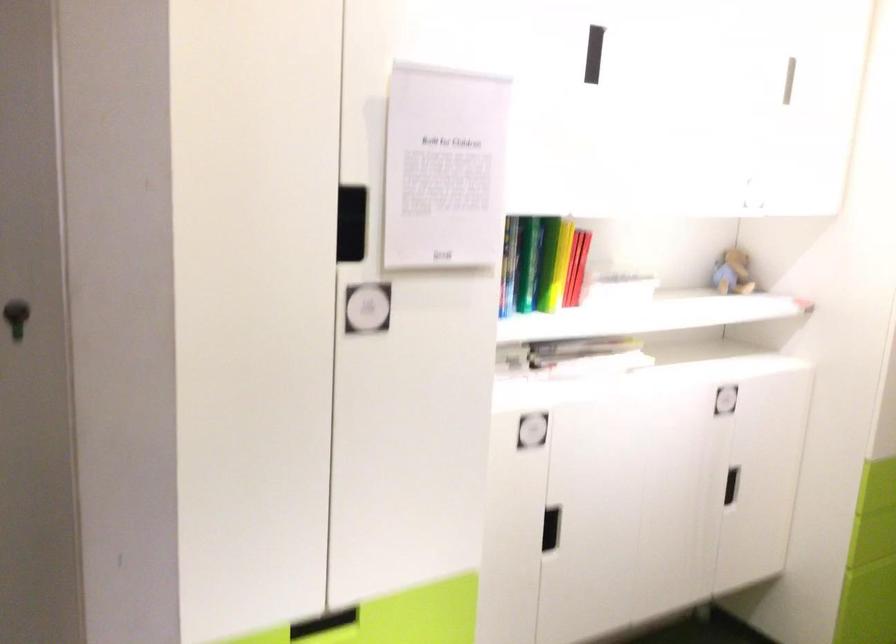
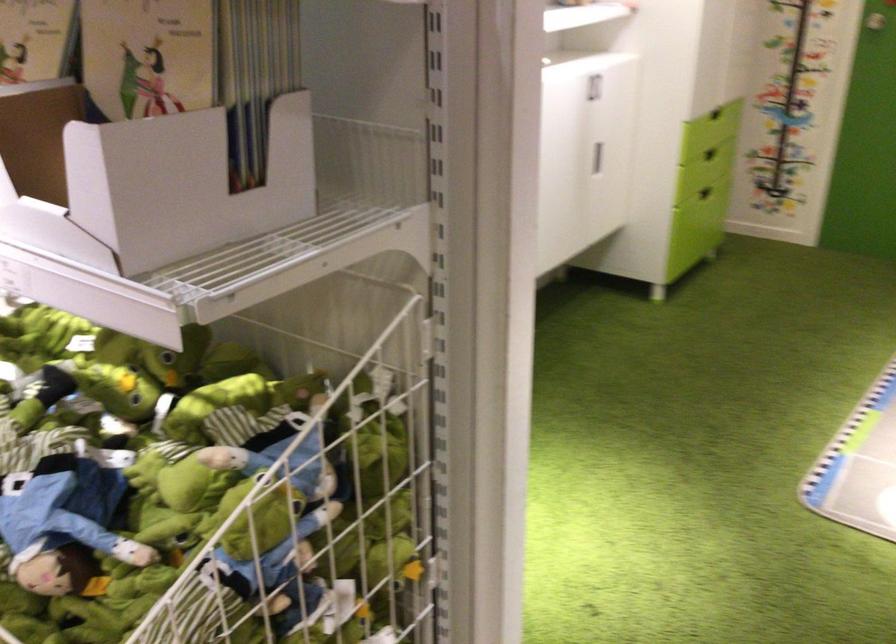
Find the pixel in the second image that matches pixel 728 489 in the first image.

(597, 158)